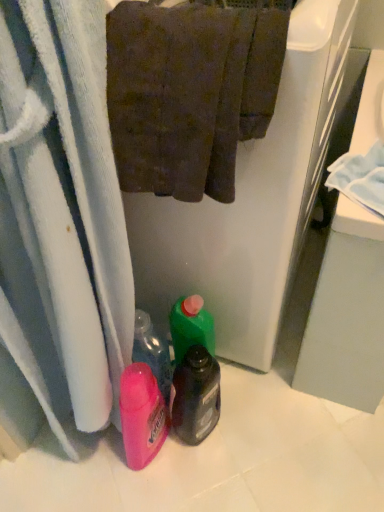
Question: Considering the relative sizes of brown textured towel at upper center and translucent plastic bottle at center in the image provided, is brown textured towel at upper center wider than translucent plastic bottle at center?

Choices:
 (A) yes
 (B) no

Answer: (A)

Question: Considering the relative sizes of brown textured towel at upper center and translucent plastic bottle at center in the image provided, is brown textured towel at upper center smaller than translucent plastic bottle at center?

Choices:
 (A) no
 (B) yes

Answer: (A)

Question: Can you confirm if brown textured towel at upper center is bigger than translucent plastic bottle at center?

Choices:
 (A) yes
 (B) no

Answer: (A)

Question: Is brown textured towel at upper center to the right of translucent plastic bottle at center from the viewer's perspective?

Choices:
 (A) yes
 (B) no

Answer: (B)

Question: Is translucent plastic bottle at center at the back of brown textured towel at upper center?

Choices:
 (A) yes
 (B) no

Answer: (B)

Question: Is brown textured towel at upper center positioned behind translucent plastic bottle at center?

Choices:
 (A) no
 (B) yes

Answer: (A)

Question: Would you say brown textured towel at upper center is part of translucent plastic bottle at center's contents?

Choices:
 (A) yes
 (B) no

Answer: (B)

Question: From a real-world perspective, is translucent plastic bottle at center under brown textured towel at upper center?

Choices:
 (A) yes
 (B) no

Answer: (A)

Question: Are translucent plastic bottle at center and brown textured towel at upper center located far from each other?

Choices:
 (A) no
 (B) yes

Answer: (A)

Question: Considering the relative sizes of translucent plastic bottle at center and brown textured towel at upper center in the image provided, is translucent plastic bottle at center wider than brown textured towel at upper center?

Choices:
 (A) yes
 (B) no

Answer: (B)

Question: Can you confirm if translucent plastic bottle at center is bigger than brown textured towel at upper center?

Choices:
 (A) yes
 (B) no

Answer: (B)

Question: Considering the relative sizes of translucent plastic bottle at center and brown textured towel at upper center in the image provided, is translucent plastic bottle at center smaller than brown textured towel at upper center?

Choices:
 (A) yes
 (B) no

Answer: (A)

Question: From a real-world perspective, relative to brown textured towel at upper center, is translucent plastic bottle at center vertically above or below?

Choices:
 (A) below
 (B) above

Answer: (A)